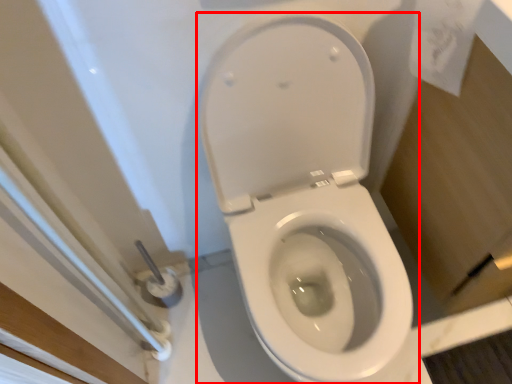
Question: In this image, where is toilet (annotated by the red box) located relative to toilet paper?

Choices:
 (A) right
 (B) left

Answer: (B)